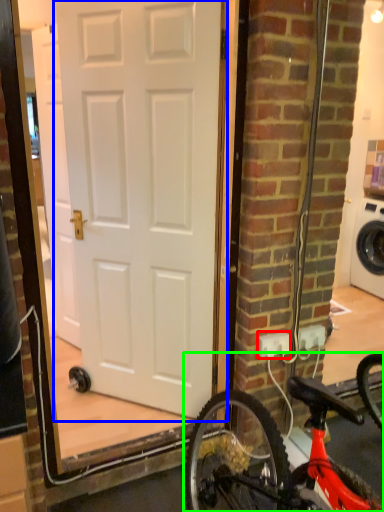
Question: Estimate the real-world distances between objects in this image. Which object is closer to electric outlet (highlighted by a red box), door (highlighted by a blue box) or bicycle (highlighted by a green box)?

Choices:
 (A) door
 (B) bicycle

Answer: (B)